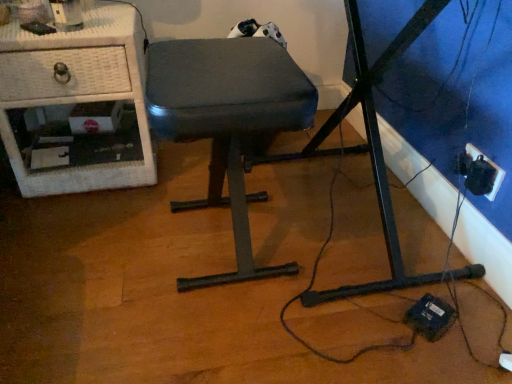
Question: Is white wicker nightstand at left closer to the viewer compared to dark gray fabric stool at center?

Choices:
 (A) yes
 (B) no

Answer: (B)

Question: Is white wicker nightstand at left turned away from dark gray fabric stool at center?

Choices:
 (A) yes
 (B) no

Answer: (B)

Question: Considering the relative sizes of white wicker nightstand at left and dark gray fabric stool at center in the image provided, is white wicker nightstand at left taller than dark gray fabric stool at center?

Choices:
 (A) no
 (B) yes

Answer: (A)

Question: Is white wicker nightstand at left oriented towards dark gray fabric stool at center?

Choices:
 (A) no
 (B) yes

Answer: (A)

Question: Considering the relative sizes of white wicker nightstand at left and dark gray fabric stool at center in the image provided, is white wicker nightstand at left smaller than dark gray fabric stool at center?

Choices:
 (A) yes
 (B) no

Answer: (B)

Question: Considering the relative positions of white wicker nightstand at left and dark gray fabric stool at center in the image provided, is white wicker nightstand at left to the right of dark gray fabric stool at center from the viewer's perspective?

Choices:
 (A) no
 (B) yes

Answer: (A)

Question: Is dark gray fabric stool at center smaller than black plastic outlet at lower right?

Choices:
 (A) yes
 (B) no

Answer: (B)

Question: Is dark gray fabric stool at center behind black plastic outlet at lower right?

Choices:
 (A) no
 (B) yes

Answer: (A)

Question: Is dark gray fabric stool at center surrounding black plastic outlet at lower right?

Choices:
 (A) no
 (B) yes

Answer: (A)

Question: Does dark gray fabric stool at center lie in front of black plastic outlet at lower right?

Choices:
 (A) no
 (B) yes

Answer: (B)

Question: Considering the relative sizes of dark gray fabric stool at center and black plastic outlet at lower right in the image provided, is dark gray fabric stool at center thinner than black plastic outlet at lower right?

Choices:
 (A) yes
 (B) no

Answer: (B)

Question: Considering the relative sizes of dark gray fabric stool at center and black plastic outlet at lower right in the image provided, is dark gray fabric stool at center wider than black plastic outlet at lower right?

Choices:
 (A) yes
 (B) no

Answer: (A)

Question: Considering the relative sizes of white wicker nightstand at left and black plastic outlet at lower right in the image provided, is white wicker nightstand at left thinner than black plastic outlet at lower right?

Choices:
 (A) no
 (B) yes

Answer: (A)